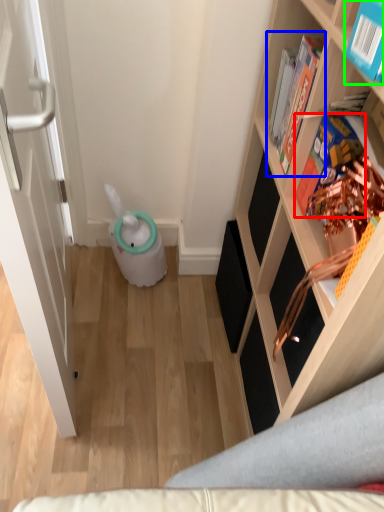
Question: Based on their relative distances, which object is farther from book (highlighted by a red box)? Choose from book (highlighted by a blue box) and book (highlighted by a green box).

Choices:
 (A) book
 (B) book

Answer: (B)